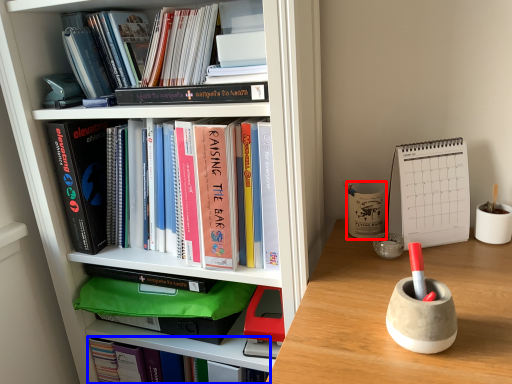
Question: Among these objects, which one is nearest to the camera, stationery (highlighted by a red box) or book (highlighted by a blue box)?

Choices:
 (A) stationery
 (B) book

Answer: (A)